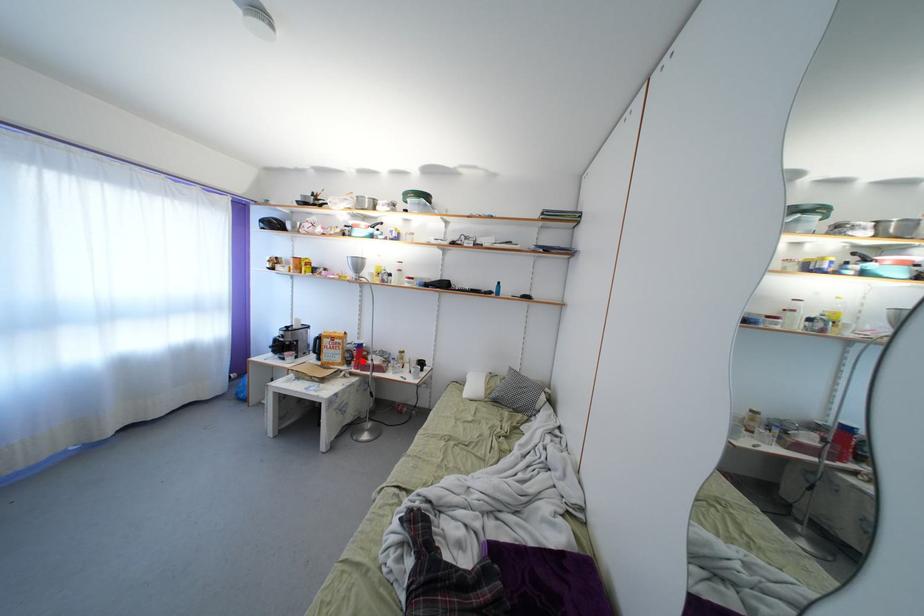
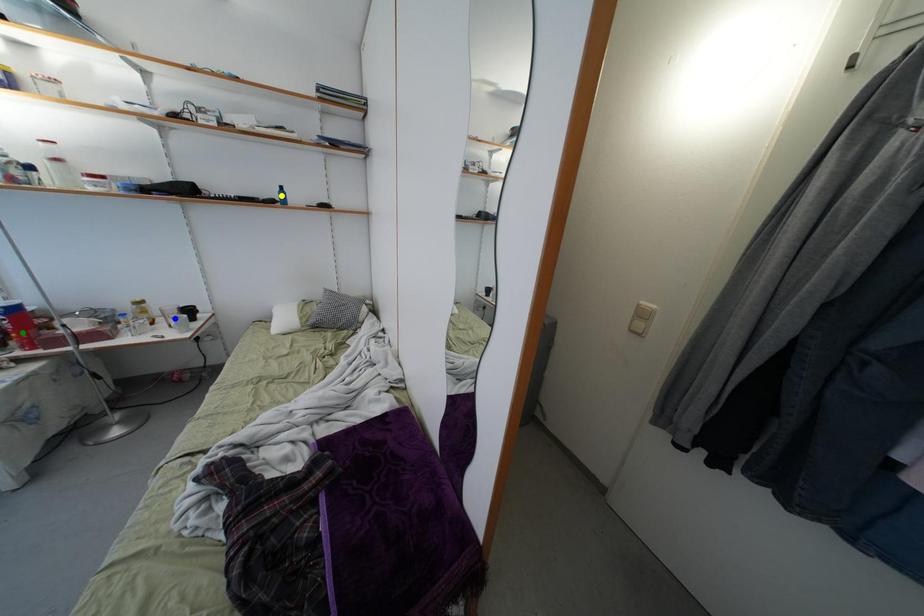
Question: I am providing you with two images of the same scene from different viewpoints. A red point is marked on the first image. You are given multiple points on the second image. Which point in image 2 is actually the same real-world point as the red point in image 1?

Choices:
 (A) blue point
 (B) green point
 (C) yellow point

Answer: (B)